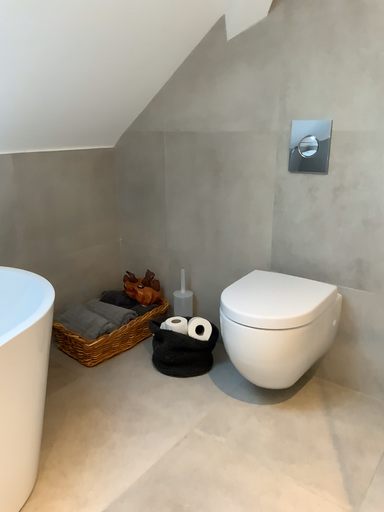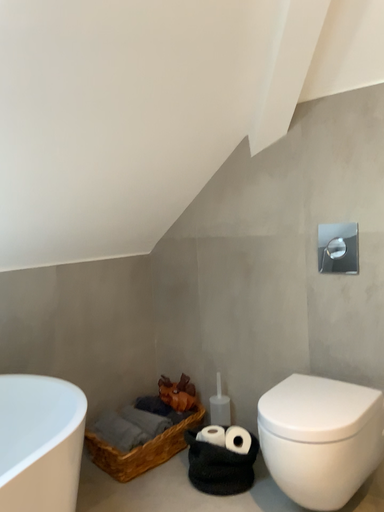
Question: Which way did the camera rotate in the video?

Choices:
 (A) rotated downward
 (B) rotated upward

Answer: (B)